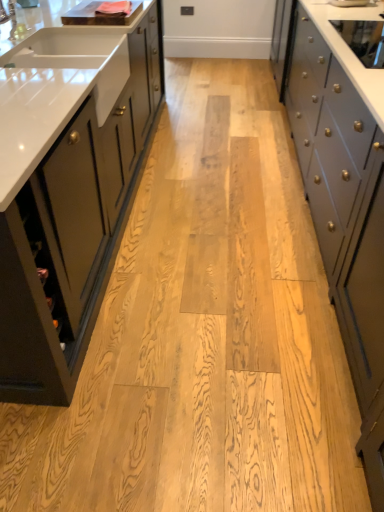
Question: Is silver metallic faucet at upper left positioned with its back to gray matte cabinet at right, which appears as the first cabinetry when viewed from the right?

Choices:
 (A) no
 (B) yes

Answer: (B)

Question: From the image's perspective, would you say silver metallic faucet at upper left is positioned over gray matte cabinet at right, which appears as the first cabinetry when viewed from the right?

Choices:
 (A) no
 (B) yes

Answer: (B)

Question: Does silver metallic faucet at upper left have a larger size compared to gray matte cabinet at right, acting as the second cabinetry starting from the left?

Choices:
 (A) no
 (B) yes

Answer: (A)

Question: Is the position of silver metallic faucet at upper left more distant than that of gray matte cabinet at right, which appears as the first cabinetry when viewed from the right?

Choices:
 (A) yes
 (B) no

Answer: (A)

Question: Does silver metallic faucet at upper left turn towards gray matte cabinet at right, which appears as the first cabinetry when viewed from the right?

Choices:
 (A) yes
 (B) no

Answer: (B)

Question: Does silver metallic faucet at upper left appear on the left side of gray matte cabinet at right, which appears as the first cabinetry when viewed from the right?

Choices:
 (A) no
 (B) yes

Answer: (B)

Question: Considering the relative sizes of silver metallic faucet at upper left and matte dark green cabinet at left, the second cabinetry when ordered from right to left, in the image provided, is silver metallic faucet at upper left shorter than matte dark green cabinet at left, the second cabinetry when ordered from right to left,?

Choices:
 (A) yes
 (B) no

Answer: (A)

Question: Does silver metallic faucet at upper left have a larger size compared to matte dark green cabinet at left, the second cabinetry when ordered from right to left?

Choices:
 (A) yes
 (B) no

Answer: (B)

Question: Are silver metallic faucet at upper left and matte dark green cabinet at left, the second cabinetry when ordered from right to left, located far from each other?

Choices:
 (A) no
 (B) yes

Answer: (A)

Question: From a real-world perspective, is silver metallic faucet at upper left on top of matte dark green cabinet at left, which ranks as the 1th cabinetry in left-to-right order?

Choices:
 (A) no
 (B) yes

Answer: (B)

Question: Considering the relative positions of silver metallic faucet at upper left and matte dark green cabinet at left, which ranks as the 1th cabinetry in left-to-right order, in the image provided, is silver metallic faucet at upper left to the right of matte dark green cabinet at left, which ranks as the 1th cabinetry in left-to-right order, from the viewer's perspective?

Choices:
 (A) no
 (B) yes

Answer: (B)

Question: Can matte dark green cabinet at left, which ranks as the 1th cabinetry in left-to-right order, be found inside silver metallic faucet at upper left?

Choices:
 (A) yes
 (B) no

Answer: (B)

Question: Is matte dark green cabinet at left, the second cabinetry when ordered from right to left, closer to the viewer compared to silver metallic faucet at upper left?

Choices:
 (A) no
 (B) yes

Answer: (B)